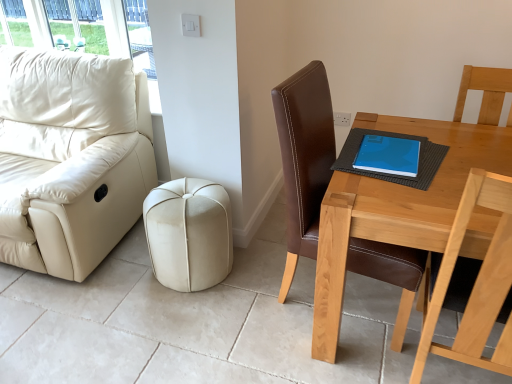
Question: Can you confirm if blue matte book at upper right is wider than blue matte notebook at table?

Choices:
 (A) no
 (B) yes

Answer: (A)

Question: Is blue matte book at upper right shorter than blue matte notebook at table?

Choices:
 (A) no
 (B) yes

Answer: (A)

Question: Considering the relative positions of blue matte book at upper right and blue matte notebook at table in the image provided, is blue matte book at upper right to the right of blue matte notebook at table from the viewer's perspective?

Choices:
 (A) no
 (B) yes

Answer: (A)

Question: Considering the relative positions of blue matte book at upper right and blue matte notebook at table in the image provided, is blue matte book at upper right in front of blue matte notebook at table?

Choices:
 (A) no
 (B) yes

Answer: (A)

Question: From the image's perspective, is blue matte book at upper right located above blue matte notebook at table?

Choices:
 (A) yes
 (B) no

Answer: (A)

Question: Does blue matte book at upper right have a larger size compared to blue matte notebook at table?

Choices:
 (A) no
 (B) yes

Answer: (A)

Question: Is brown leather chair at right positioned with its back to blue matte notebook at table?

Choices:
 (A) yes
 (B) no

Answer: (A)

Question: Is brown leather chair at right taller than blue matte notebook at table?

Choices:
 (A) yes
 (B) no

Answer: (A)

Question: From the image's perspective, would you say brown leather chair at right is shown under blue matte notebook at table?

Choices:
 (A) no
 (B) yes

Answer: (B)

Question: Does brown leather chair at right come behind blue matte notebook at table?

Choices:
 (A) yes
 (B) no

Answer: (B)

Question: Is blue matte notebook at table completely or partially inside brown leather chair at right?

Choices:
 (A) no
 (B) yes

Answer: (B)

Question: Considering the relative positions of brown leather chair at right and blue matte notebook at table in the image provided, is brown leather chair at right to the left of blue matte notebook at table from the viewer's perspective?

Choices:
 (A) no
 (B) yes

Answer: (B)

Question: Are light brown wooden table at right and brown leather chair at right far apart?

Choices:
 (A) no
 (B) yes

Answer: (A)